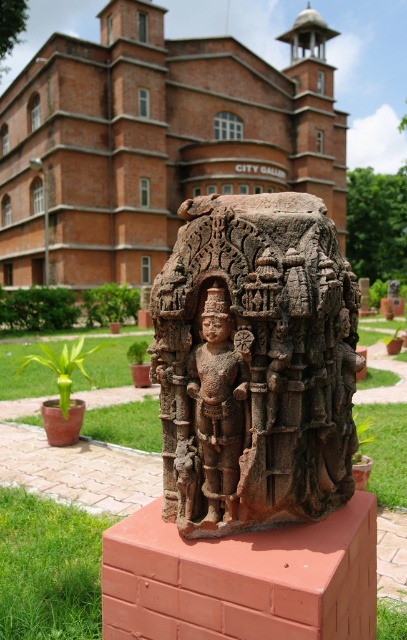
Where is `brown stone statue at center`? brown stone statue at center is located at coordinates (255, 364).

Does point (203, 499) come behind point (223, 300)?

Yes, point (203, 499) is behind point (223, 300).

Is point (190, 513) farther from camera compared to point (234, 381)?

Yes, point (190, 513) is behind point (234, 381).

Where is `brown stone statue at center`? The image size is (407, 640). brown stone statue at center is located at coordinates (255, 364).